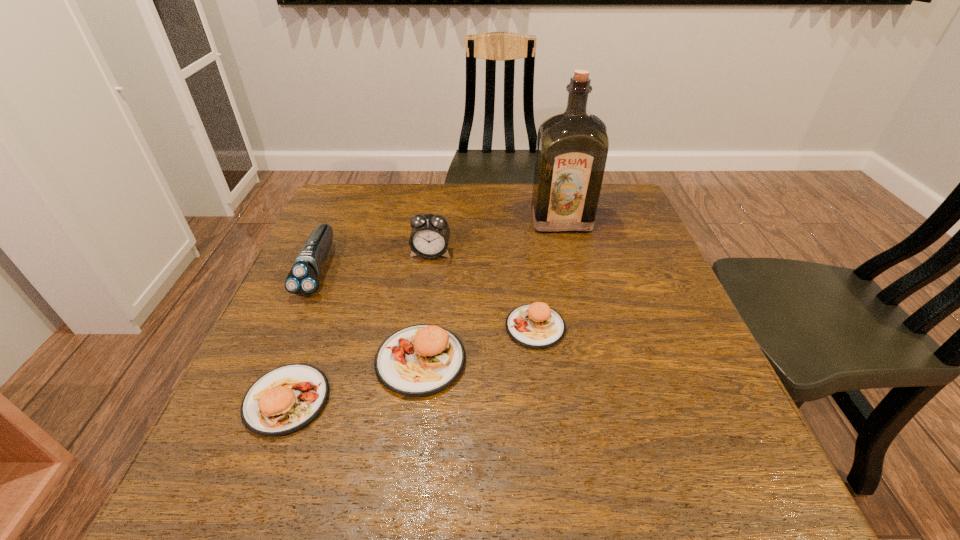
Identify the location of free space at the far edge. (451, 187).

I want to click on vacant region at the near edge, so pyautogui.click(x=432, y=427).

This screenshot has width=960, height=540. Identify the location of vacant point at the left edge. (337, 322).

Locate an element on the screen. The image size is (960, 540). free space at the right edge is located at coordinates (658, 370).

Identify the location of vacant area at the far right corner. This screenshot has width=960, height=540. (612, 187).

The image size is (960, 540). Identify the location of unoccupied area between the tallest object and the rightmost patty. (548, 274).

Identify the location of free spot between the tallest object and the second patty from right to left. This screenshot has width=960, height=540. (491, 291).

In order to click on empty space between the second patty from right to left and the second tallest object in this screenshot , I will do `click(425, 307)`.

Locate an element on the screen. Image resolution: width=960 pixels, height=540 pixels. free space that is in between the leftmost patty and the second patty from right to left is located at coordinates (354, 380).

Where is `vacant area that lies between the second patty from left to right and the farthest object`? Image resolution: width=960 pixels, height=540 pixels. vacant area that lies between the second patty from left to right and the farthest object is located at coordinates (x=491, y=291).